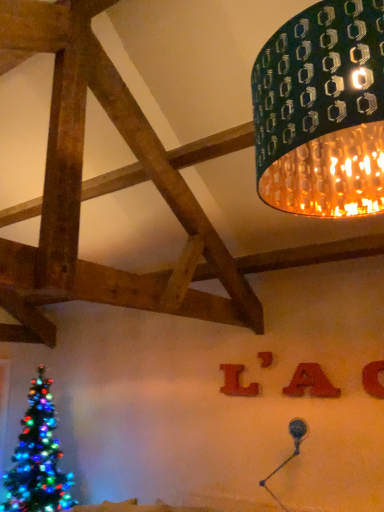
Question: From a real-world perspective, is orange matte letter at upper right, the third alphabet from the left, positioned above or below metallic silver table lamp at lower right?

Choices:
 (A) above
 (B) below

Answer: (A)

Question: Is orange matte letter at upper right, which is the 1th alphabet from right to left, bigger or smaller than metallic silver table lamp at lower right?

Choices:
 (A) big
 (B) small

Answer: (B)

Question: Estimate the real-world distances between objects in this image. Which object is farther from the matte red letter at center, acting as the first alphabet starting from the back?

Choices:
 (A) matte red letter at upper center
 (B) orange matte letter at upper right, which is the 1th alphabet from right to left
 (C) metallic silver table lamp at lower right
 (D) green textured lampshade at upper right
 (E) red felt letter a at upper center, the 2th alphabet from the back

Answer: (D)

Question: Based on their relative distances, which object is farther from the matte red letter at center, which is the 1th alphabet from left to right?

Choices:
 (A) metallic silver table lamp at lower right
 (B) red felt letter a at upper center, the second alphabet viewed from the left
 (C) orange matte letter at upper right, the third alphabet from the left
 (D) green textured lampshade at upper right
 (E) matte red letter at upper center

Answer: (D)